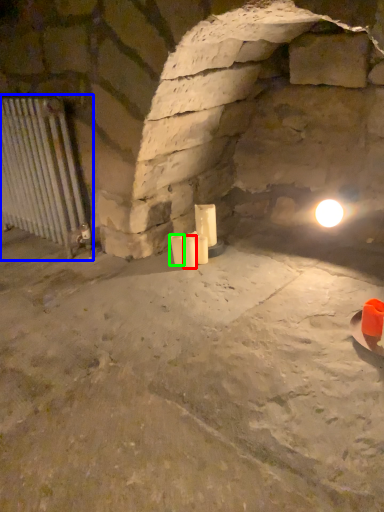
Question: Which object is the farthest from candle (highlighted by a red box)? Choose among these: cage (highlighted by a blue box) or candle (highlighted by a green box).

Choices:
 (A) cage
 (B) candle

Answer: (A)